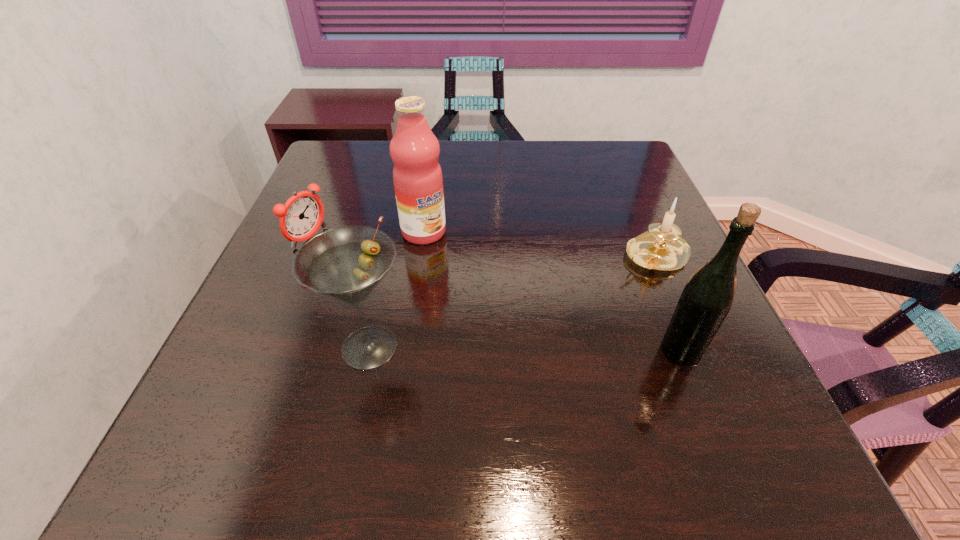
I want to click on vacant point located between the fruit juice and the beer bottle, so click(552, 291).

Where is `free spot between the fruit juice and the candle holder`? This screenshot has height=540, width=960. free spot between the fruit juice and the candle holder is located at coordinates (539, 244).

I want to click on free spot between the martini and the fruit juice, so click(396, 289).

The width and height of the screenshot is (960, 540). I want to click on free space that is in between the fourth tallest object and the shortest object, so [482, 246].

Select which object appears as the fourth closest to the third tallest object. Please provide its 2D coordinates. Your answer should be formatted as a tuple, i.e. [(x, y)], where the tuple contains the x and y coordinates of a point satisfying the conditions above.

[(707, 297)]

Identify the location of the second closest object to the fruit juice. The image size is (960, 540). pyautogui.click(x=346, y=263).

At what (x,y) coordinates should I click in order to perform the action: click on free space that satisfies the following two spatial constraints: 1. on the front side of the beer bottle; 2. on the right side of the fruit juice. Please return your answer as a coordinate pair (x, y). The image size is (960, 540). Looking at the image, I should click on (406, 350).

This screenshot has height=540, width=960. I want to click on free space that satisfies the following two spatial constraints: 1. on the front side of the second shortest object; 2. on the left side of the fruit juice, so click(x=420, y=255).

Image resolution: width=960 pixels, height=540 pixels. In order to click on vacant area in the image that satisfies the following two spatial constraints: 1. on the front side of the shortest object; 2. on the left side of the martini in this screenshot , I will do `click(262, 347)`.

Identify the location of blank space that satisfies the following two spatial constraints: 1. on the front side of the shortest object; 2. on the left side of the candle holder. (302, 255).